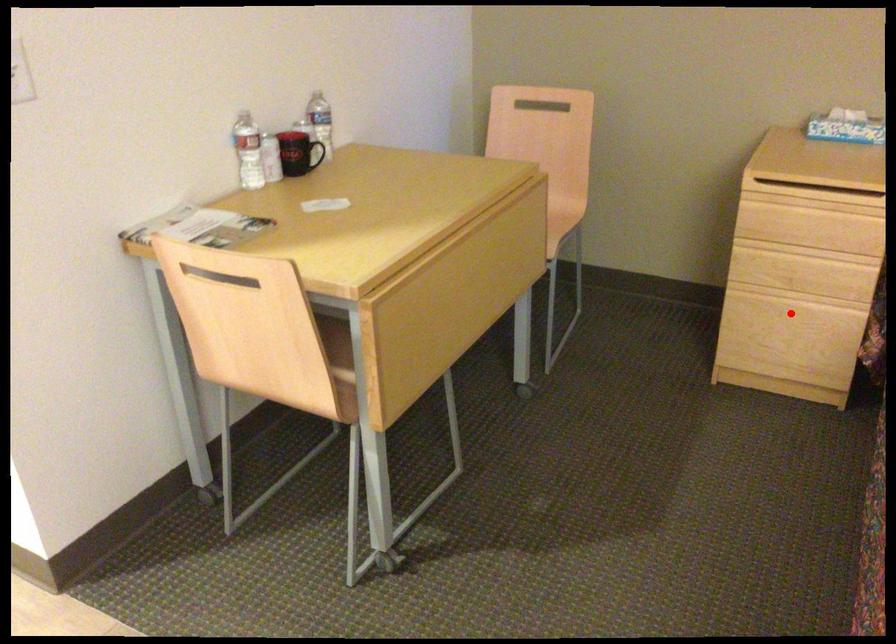
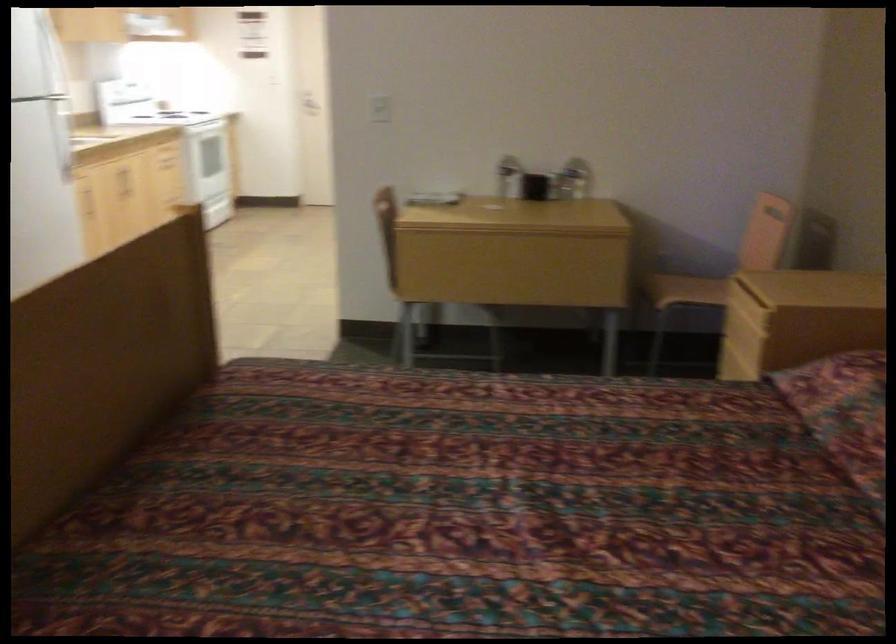
Question: I am providing you with two images of the same scene from different viewpoints. A red point is marked on the first image. Can you still see the location of the red point in image 2?

Choices:
 (A) Yes
 (B) No

Answer: (B)